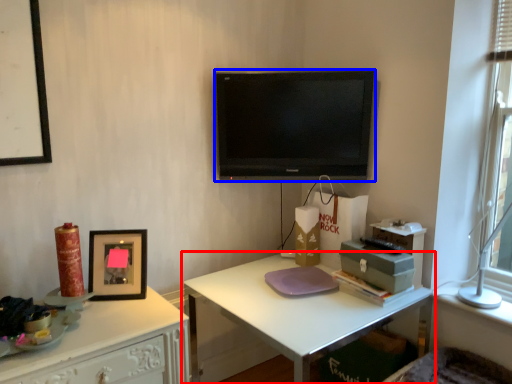
Question: Which object appears farthest to the camera in this image, desk (highlighted by a red box) or television (highlighted by a blue box)?

Choices:
 (A) desk
 (B) television

Answer: (B)